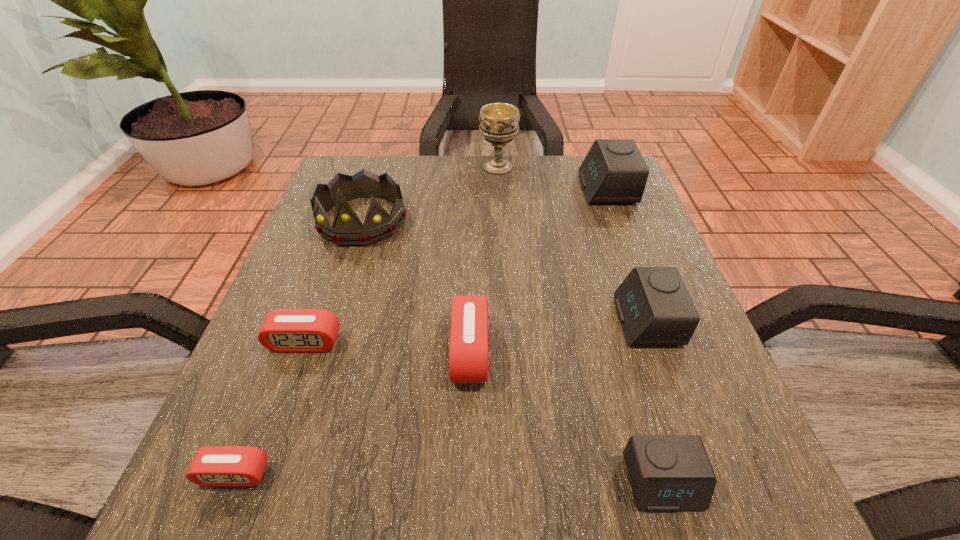
Locate an element on the screen. The height and width of the screenshot is (540, 960). pink alarm clock that can be found as the closest to the third alarm clock from left to right is located at coordinates (283, 330).

Locate an element on the screen. free location that satisfies the following two spatial constraints: 1. on the front-facing side of the farthest black alarm clock; 2. on the front-facing side of the nearest pink alarm clock is located at coordinates (713, 474).

The image size is (960, 540). Find the location of `free region that satisfies the following two spatial constraints: 1. on the front-facing side of the tallest alarm clock; 2. on the front-facing side of the nearest pink alarm clock`. free region that satisfies the following two spatial constraints: 1. on the front-facing side of the tallest alarm clock; 2. on the front-facing side of the nearest pink alarm clock is located at coordinates (713, 474).

Find the location of a particular element. free space in the image that satisfies the following two spatial constraints: 1. on the front-facing side of the biggest black alarm clock; 2. on the front-facing side of the smallest black alarm clock is located at coordinates (717, 482).

What are the coordinates of `vacant space that satisfies the following two spatial constraints: 1. on the front-facing side of the second biggest black alarm clock; 2. on the front-facing side of the second biggest pink alarm clock` in the screenshot? It's located at (654, 342).

The width and height of the screenshot is (960, 540). I want to click on vacant area in the image that satisfies the following two spatial constraints: 1. on the front-facing side of the sixth shortest object; 2. on the front-facing side of the shortest alarm clock, so click(x=713, y=474).